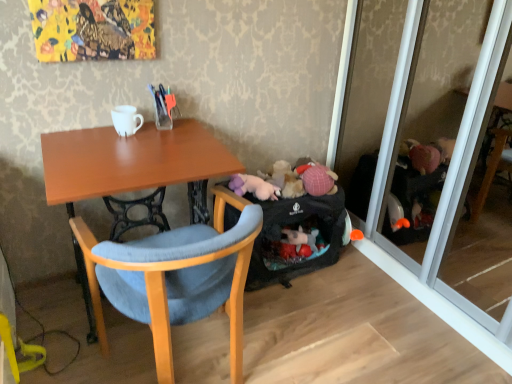
Image resolution: width=512 pixels, height=384 pixels. I want to click on vacant area that lies between transparent glass screen door at right and black fabric luggage at lower right, so click(x=357, y=312).